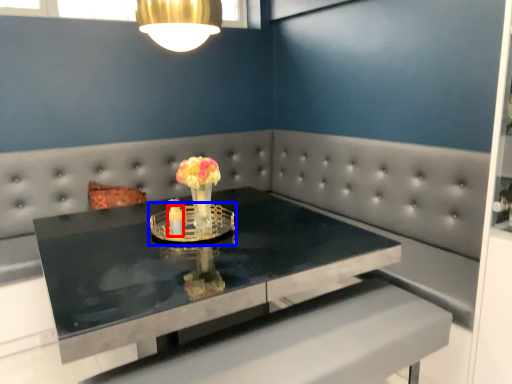
Question: Which of the following is the farthest to the observer, candle holder (highlighted by a red box) or candle holder (highlighted by a blue box)?

Choices:
 (A) candle holder
 (B) candle holder

Answer: (A)